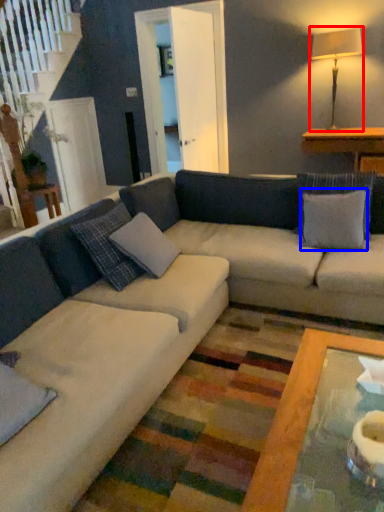
Question: Among these objects, which one is farthest to the camera, table lamp (highlighted by a red box) or pillow (highlighted by a blue box)?

Choices:
 (A) table lamp
 (B) pillow

Answer: (A)